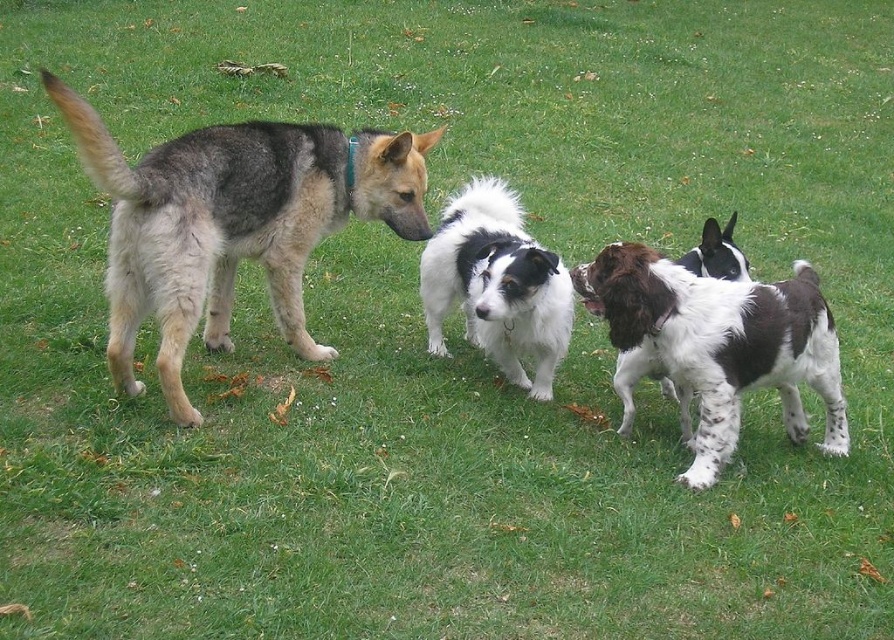
Is white fluffy dog at center wider than white speckled fur dog at center?

Yes.

Does point (502, 180) come closer to viewer compared to point (689, 256)?

That is False.

The height and width of the screenshot is (640, 894). In order to click on white fluffy dog at center in this screenshot , I will do `click(496, 284)`.

Can you confirm if spotted fur dog at center is positioned above white fluffy dog at center?

No.

Does spotted fur dog at center come behind white fluffy dog at center?

No, it is in front of white fluffy dog at center.

Who is more distant from viewer, (572, 282) or (561, 349)?

Positioned behind is point (561, 349).

The image size is (894, 640). I want to click on spotted fur dog at center, so click(x=721, y=344).

Who is taller, gray-furred dog at left or spotted fur dog at center?

Standing taller between the two is gray-furred dog at left.

Is point (187, 413) more distant than point (812, 317)?

No, it is in front of (812, 317).

Describe the element at coordinates (232, 224) in the screenshot. This screenshot has width=894, height=640. I see `gray-furred dog at left` at that location.

The image size is (894, 640). Find the location of `gray-furred dog at left`. gray-furred dog at left is located at coordinates (232, 224).